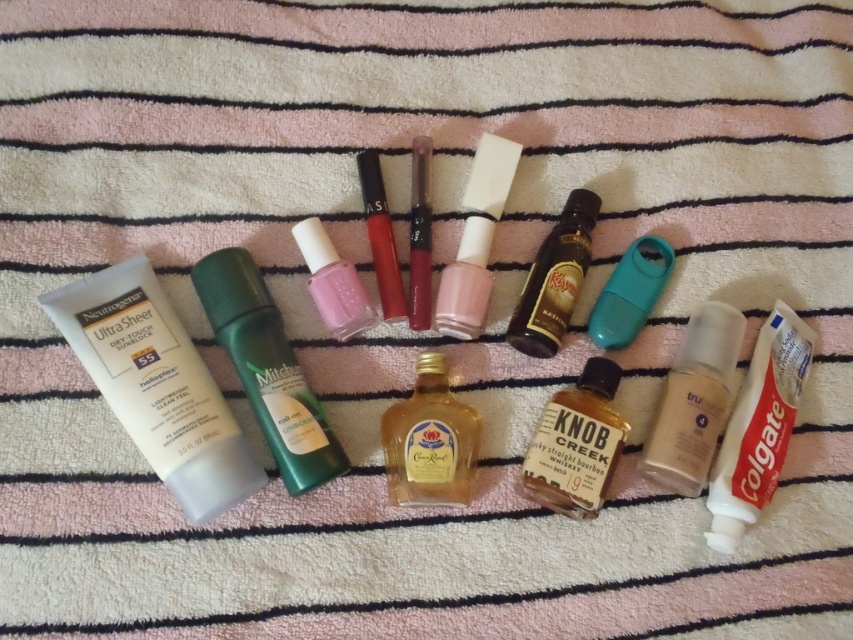
From the picture: You are standing in front of the striped towel with beauty products. There are two points marked on the towel at coordinates point [281,458] and point [556,484]. Which point is closer to you?

Point [281,458] is closer to the viewer than point [556,484].

You are organizing a gift basket and need to place the brown matte whiskey bottle at center and the shiny metallic lipstick at center in a specific order. According to the arrangement in the image, which item is placed to the right of the other?

The brown matte whiskey bottle at center is positioned on the right side of shiny metallic lipstick at center, so the whiskey bottle is to the right of the lipstick.